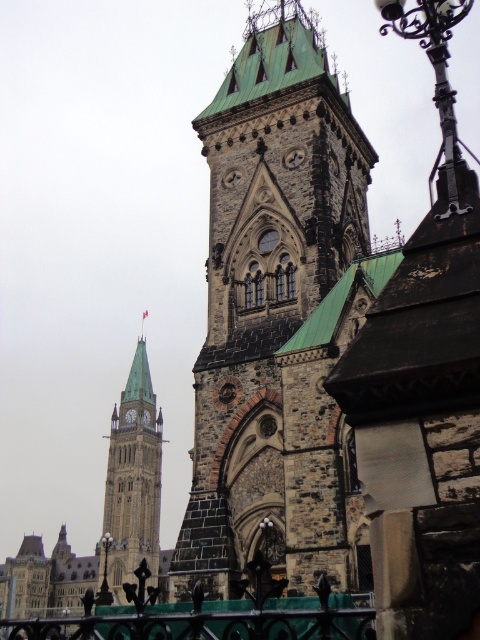
Question: Which of the following is the closest to the observer?

Choices:
 (A) (252, 636)
 (B) (132, 513)

Answer: (A)

Question: Is dark gray stone tower at center above green copper clock tower at left?

Choices:
 (A) yes
 (B) no

Answer: (A)

Question: Among these points, which one is nearest to the camera?

Choices:
 (A) (302, 563)
 (B) (99, 634)

Answer: (B)

Question: Does dark gray stone tower at center appear over green wrought iron fence at lower center?

Choices:
 (A) no
 (B) yes

Answer: (B)

Question: Observing the image, what is the correct spatial positioning of dark gray stone tower at center in reference to green copper clock tower at left?

Choices:
 (A) above
 (B) below

Answer: (A)

Question: Which of the following is the closest to the observer?

Choices:
 (A) click(199, 627)
 (B) click(145, 481)
 (C) click(236, 272)

Answer: (A)